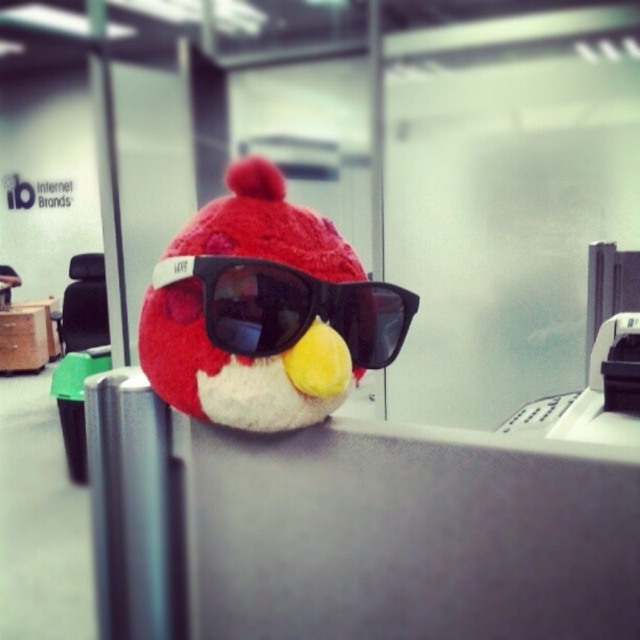
Question: Is matte plush toy at center in front of black matte sunglasses at center?

Choices:
 (A) yes
 (B) no

Answer: (A)

Question: Can you confirm if matte plush toy at center is positioned below black matte sunglasses at center?

Choices:
 (A) no
 (B) yes

Answer: (A)

Question: Which object is closer to the camera taking this photo?

Choices:
 (A) black matte sunglasses at center
 (B) matte plush toy at center

Answer: (B)

Question: Among these points, which one is nearest to the camera?

Choices:
 (A) (344, 369)
 (B) (198, 266)

Answer: (B)

Question: In this image, where is matte plush toy at center located relative to black matte sunglasses at center?

Choices:
 (A) right
 (B) left

Answer: (B)